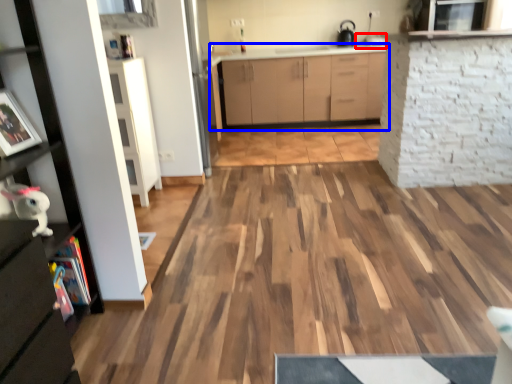
Question: Which object is further to the camera taking this photo, sink (highlighted by a red box) or cabinetry (highlighted by a blue box)?

Choices:
 (A) sink
 (B) cabinetry

Answer: (A)